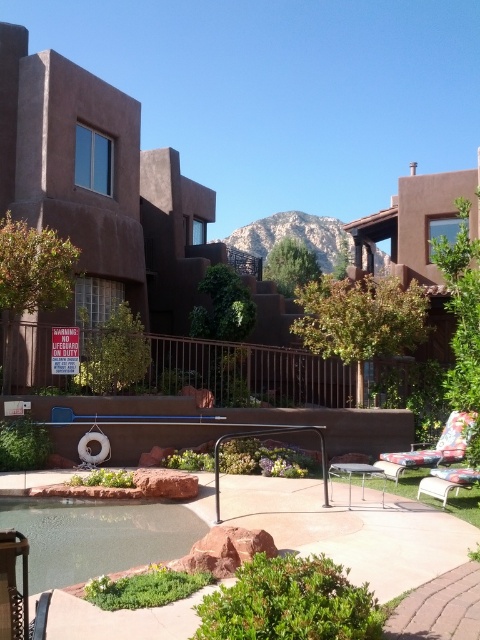
Which of these two, clear glass pool at center or white plastic chair at lower right, stands shorter?

clear glass pool at center is shorter.

Describe the element at coordinates (96, 536) in the screenshot. I see `clear glass pool at center` at that location.

Between point (93, 525) and point (444, 477), which one is positioned behind?

Point (93, 525)

Locate an element on the screen. The image size is (480, 640). clear glass pool at center is located at coordinates (96, 536).

Is clear glass pool at center thinner than floral fabric lounge chair at lower right?

No, clear glass pool at center is not thinner than floral fabric lounge chair at lower right.

Is point (120, 536) behind point (464, 451)?

That is False.

The width and height of the screenshot is (480, 640). Find the location of `clear glass pool at center`. clear glass pool at center is located at coordinates (96, 536).

Identify the location of clear glass pool at center. The width and height of the screenshot is (480, 640). (96, 536).

The height and width of the screenshot is (640, 480). Describe the element at coordinates (440, 444) in the screenshot. I see `floral fabric lounge chair at lower right` at that location.

Between floral fabric lounge chair at lower right and white plastic chair at lower right, which one has less height?

With less height is white plastic chair at lower right.

The height and width of the screenshot is (640, 480). I want to click on floral fabric lounge chair at lower right, so click(x=440, y=444).